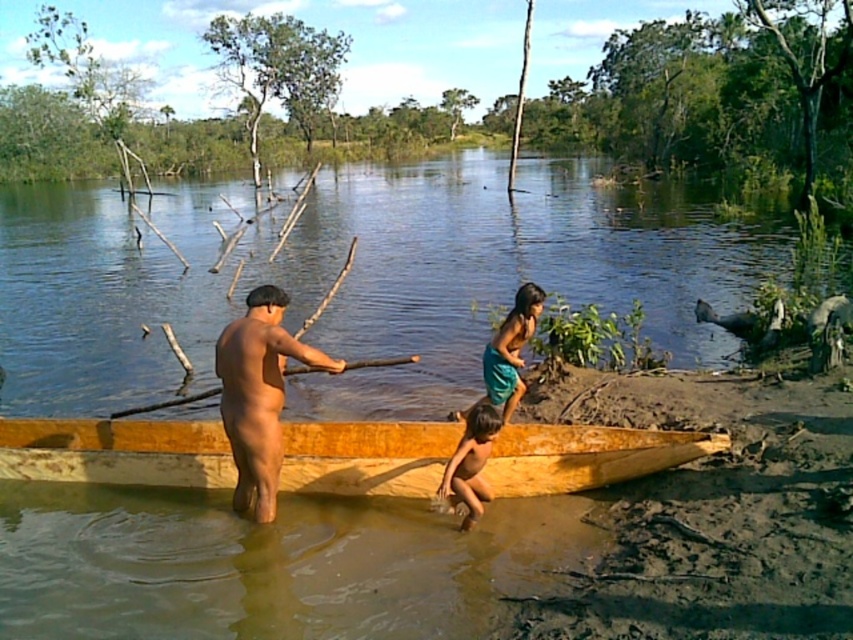
Question: Which of the following is the closest to the observer?

Choices:
 (A) brown skin at center
 (B) wooden stick at center
 (C) teal fabric skirt at center
 (D) light brown wooden boat at lower center

Answer: (A)

Question: Does light brown wooden boat at lower center come in front of wooden stick at center?

Choices:
 (A) no
 (B) yes

Answer: (B)

Question: Does brown skin child at lower center appear over wooden stick at center?

Choices:
 (A) yes
 (B) no

Answer: (B)

Question: Which of the following is the farthest from the observer?

Choices:
 (A) (467, 460)
 (B) (540, 465)

Answer: (B)

Question: Does light brown wooden boat at lower center appear over brown skin at center?

Choices:
 (A) no
 (B) yes

Answer: (A)

Question: Estimate the real-world distances between objects in this image. Which object is closer to the wooden stick at center?

Choices:
 (A) teal fabric skirt at center
 (B) brown skin child at lower center
 (C) light brown wooden boat at lower center
 (D) brown skin at center

Answer: (D)